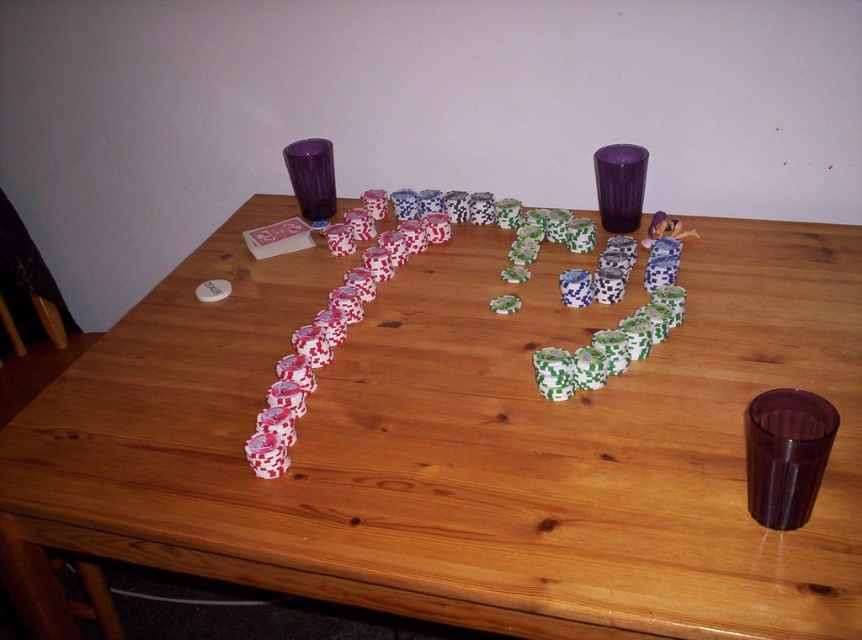
You are at a party and want to grab a drink. There are two shot glasses on the table. One is a transparent plastic shot glass at lower right and the other is a transparent purple shot glass at upper center. Which shot glass is closer to you?

The transparent plastic shot glass at lower right is closer to you because it is in front of the transparent purple shot glass at upper center.

You are a bartender who needs to place a 50 cm long bottle between the transparent purple shot glass at upper center and the purple plastic shot glass at upper center on the table. Can the bottle fit between them without overlapping either shot glass?

The distance between the transparent purple shot glass at upper center and the purple plastic shot glass at upper center is 53.97 centimeters. Since the bottle is 50 cm long, it can fit between them as the space is slightly larger than the bottle.